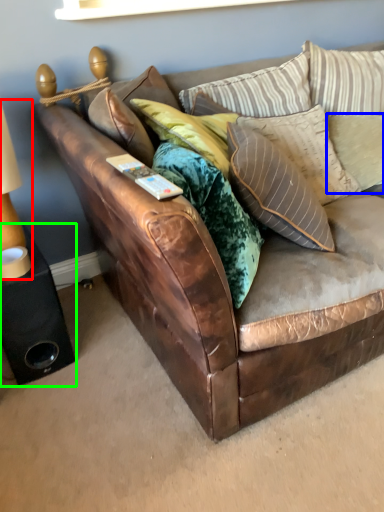
Question: Based on their relative distances, which object is farther from table lamp (highlighted by a red box)? Choose from pillow (highlighted by a blue box) and speaker (highlighted by a green box).

Choices:
 (A) pillow
 (B) speaker

Answer: (A)